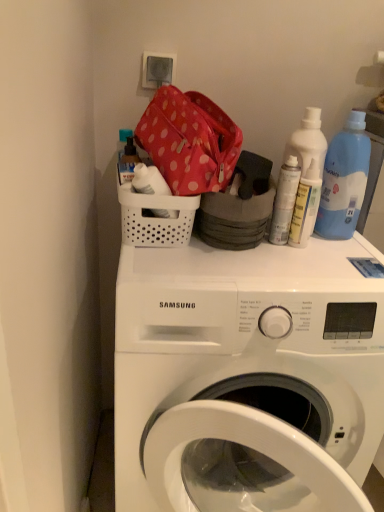
At what (x,y) coordinates should I click in order to perform the action: click on free space to the left of white matte spray can at upper right, placed as the second bottle when sorted from right to left. Please return your answer as a coordinate pair (x, y). Looking at the image, I should click on (194, 253).